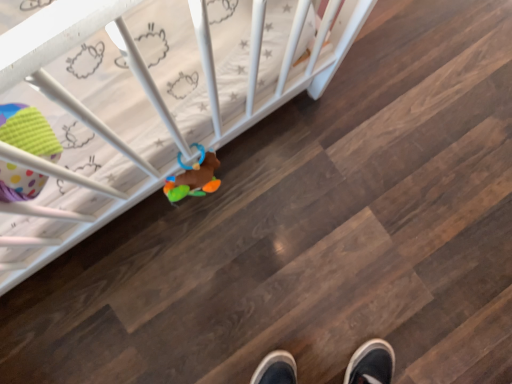
At what (x,y) coordinates should I click in order to perform the action: click on blank space situated above white plastic crib at upper left (from a real-world perspective). Please return your answer as a coordinate pair (x, y). This screenshot has width=512, height=384. Looking at the image, I should click on pos(269,236).